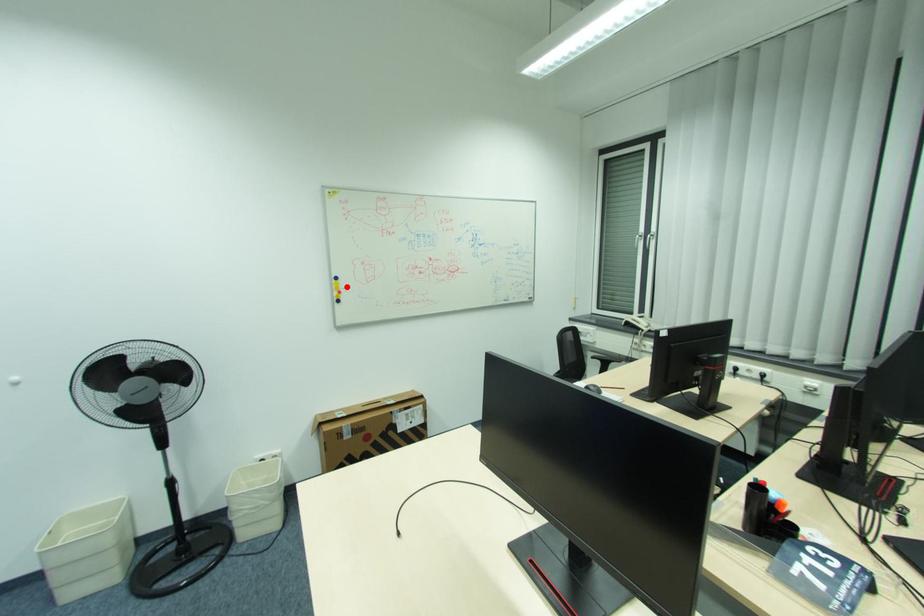
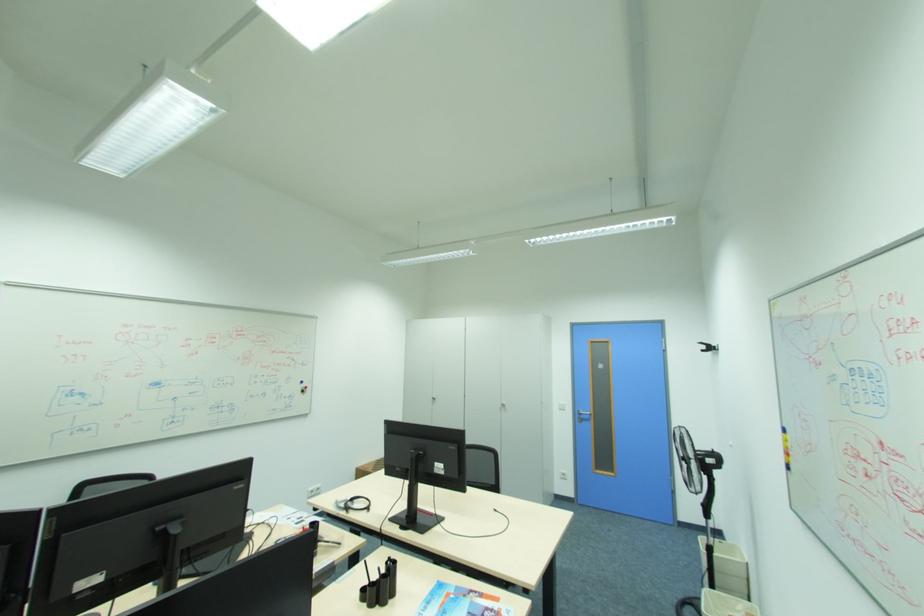
Question: I am providing you with two images of the same scene from different viewpoints. A red point is shown in image1. For the corresponding object point in image2, is it positioned nearer or farther from the camera?

Choices:
 (A) Nearer
 (B) Farther

Answer: (B)